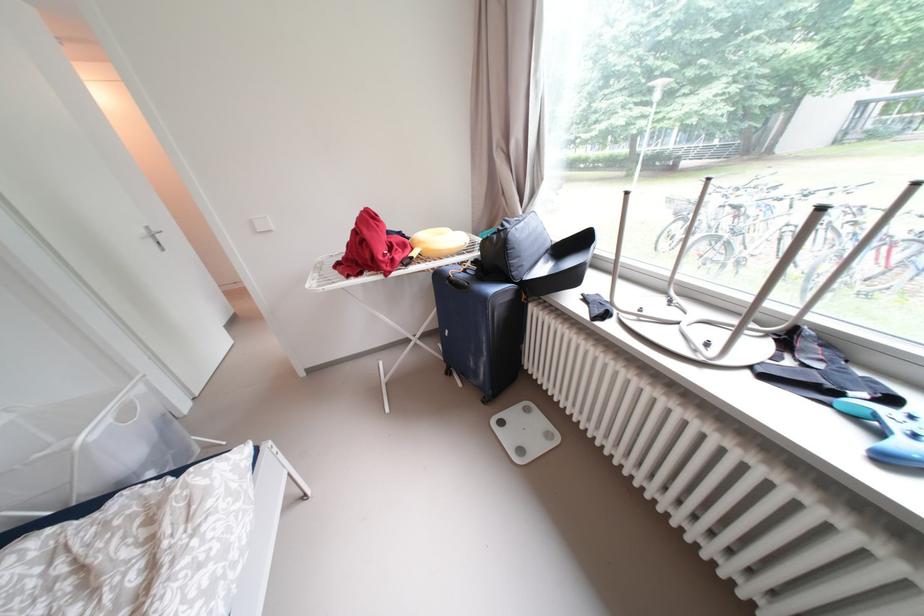
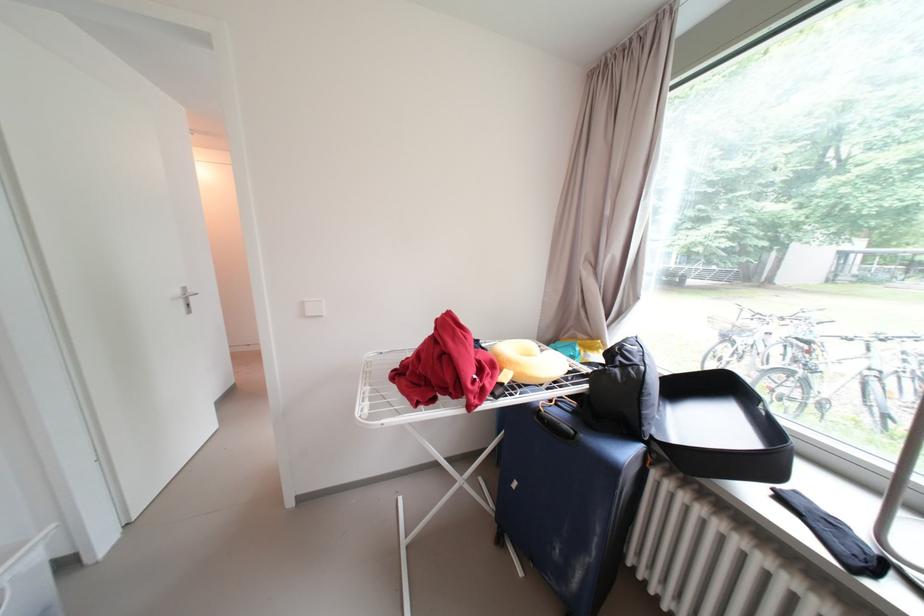
In the second image, find the point that corresponds to (x=457, y=277) in the first image.

(549, 411)